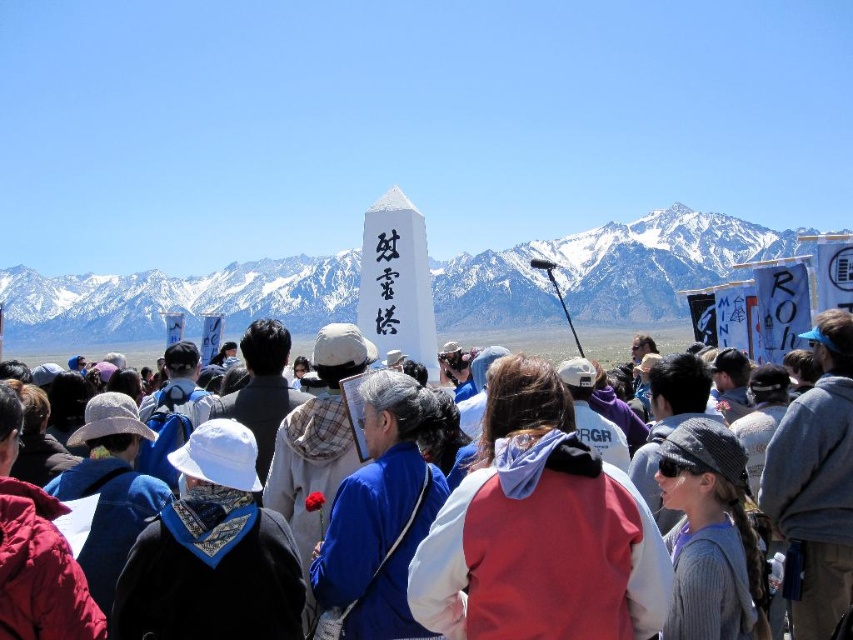
Between red hoodie at center and white matte monument at center, which one appears on the left side from the viewer's perspective?

white matte monument at center

Is red hoodie at center positioned in front of white matte monument at center?

Yes, red hoodie at center is closer to the viewer.

Which is in front, point (544, 417) or point (560, 339)?

Positioned in front is point (544, 417).

The width and height of the screenshot is (853, 640). I want to click on red hoodie at center, so click(538, 531).

Is point (641, 292) positioned in front of point (554, 355)?

That is False.

From the picture: Is white snow-covered mountain range at upper center shorter than white matte monument at center?

Incorrect, white snow-covered mountain range at upper center's height does not fall short of white matte monument at center's.

Is point (270, 276) behind point (525, 344)?

Yes, it is.

Locate an element on the screen. The image size is (853, 640). white snow-covered mountain range at upper center is located at coordinates (604, 272).

Does white snow-covered mountain range at upper center appear on the left side of red hoodie at center?

Correct, you'll find white snow-covered mountain range at upper center to the left of red hoodie at center.

Between point (677, 248) and point (503, 620), which one is positioned in front?

Point (503, 620) is in front.

Image resolution: width=853 pixels, height=640 pixels. I want to click on white snow-covered mountain range at upper center, so click(x=604, y=272).